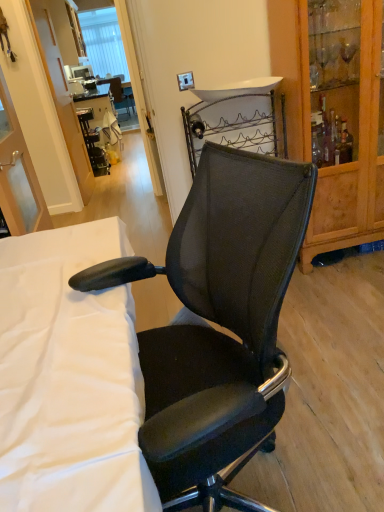
What do you see at coordinates (343, 121) in the screenshot?
I see `wooden cabinet at right` at bounding box center [343, 121].

At what (x,y) coordinates should I click in order to perform the action: click on wooden cabinet at right. Please return your answer as a coordinate pair (x, y). The image size is (384, 512). Looking at the image, I should click on (343, 121).

What do you see at coordinates (218, 320) in the screenshot?
I see `black mesh office chair at center` at bounding box center [218, 320].

Where is `black plastic table at center`? The image size is (384, 512). black plastic table at center is located at coordinates (95, 126).

Is wooden cabinet at right surrounding black mesh office chair at center?

No.

Considering the relative positions of wooden cabinet at right and black mesh office chair at center in the image provided, is wooden cabinet at right to the right of black mesh office chair at center from the viewer's perspective?

Indeed, wooden cabinet at right is positioned on the right side of black mesh office chair at center.

Can you tell me how much wooden cabinet at right and black mesh office chair at center differ in facing direction?

wooden cabinet at right and black mesh office chair at center are facing 73.5 degrees away from each other.

From a real-world perspective, is black plastic table at center above or below black mesh office chair at center?

In terms of real-world spatial position, black plastic table at center is below black mesh office chair at center.

From the image's perspective, does black plastic table at center appear higher than black mesh office chair at center?

Yes, from the image's perspective, black plastic table at center is on top of black mesh office chair at center.

From the picture: Can you confirm if black plastic table at center is positioned to the right of black mesh office chair at center?

No, black plastic table at center is not to the right of black mesh office chair at center.

Is white fabric at center to the right of wooden cabinet at right from the viewer's perspective?

Incorrect, white fabric at center is not on the right side of wooden cabinet at right.

Based on the photo, considering the relative sizes of white fabric at center and wooden cabinet at right in the image provided, is white fabric at center bigger than wooden cabinet at right?

Correct, white fabric at center is larger in size than wooden cabinet at right.

How many degrees apart are the facing directions of white fabric at center and wooden cabinet at right?

90 degrees separate the facing orientations of white fabric at center and wooden cabinet at right.

Where is `desk in front of the wooden cabinet at right`? Image resolution: width=384 pixels, height=512 pixels. desk in front of the wooden cabinet at right is located at coordinates (69, 377).

You are a GUI agent. You are given a task and a screenshot of the screen. Output one action in this format:
    pyautogui.click(x=<x>, y=<y>)
    Task: Click on the desk that is in front of the black mesh office chair at center
    This screenshot has height=512, width=384.
    Given the screenshot: What is the action you would take?
    pyautogui.click(x=69, y=377)

Can you confirm if white fabric at center is smaller than black mesh office chair at center?

Incorrect, white fabric at center is not smaller in size than black mesh office chair at center.

Considering the relative positions of white fabric at center and black mesh office chair at center in the image provided, is white fabric at center to the right of black mesh office chair at center from the viewer's perspective?

No, white fabric at center is not to the right of black mesh office chair at center.

Which of these two, white fabric at center or black mesh office chair at center, stands shorter?

white fabric at center.

From the image's perspective, which is below, black plastic table at center or white fabric at center?

From the image's view, white fabric at center is below.

Is black plastic table at center far from white fabric at center?

Yes.

Consider the image. Is black plastic table at center located outside white fabric at center?

Yes, black plastic table at center is outside of white fabric at center.

Is the position of black plastic table at center less distant than that of white fabric at center?

No, the depth of black plastic table at center is greater than that of white fabric at center.

Considering the sizes of objects black mesh office chair at center and wooden cabinet at right in the image provided, who is shorter, black mesh office chair at center or wooden cabinet at right?

Standing shorter between the two is black mesh office chair at center.

Based on the photo, is black mesh office chair at center touching wooden cabinet at right?

black mesh office chair at center and wooden cabinet at right are clearly separated.

Does black mesh office chair at center turn towards wooden cabinet at right?

No, black mesh office chair at center is not aimed at wooden cabinet at right.

Which of these two, black mesh office chair at center or wooden cabinet at right, is wider?

Wider between the two is black mesh office chair at center.

From a real-world perspective, is wooden cabinet at right positioned under white fabric at center based on gravity?

Incorrect, from a real-world perspective, wooden cabinet at right is higher than white fabric at center.

In the scene shown: Considering the sizes of objects wooden cabinet at right and white fabric at center in the image provided, who is shorter, wooden cabinet at right or white fabric at center?

white fabric at center.

Considering the positions of objects wooden cabinet at right and white fabric at center in the image provided, who is in front, wooden cabinet at right or white fabric at center?

white fabric at center is more forward.

From the picture: From the image's perspective, is wooden cabinet at right located above or below white fabric at center?

Clearly, from the image's perspective, wooden cabinet at right is above white fabric at center.

Image resolution: width=384 pixels, height=512 pixels. I want to click on cabinetry on the right of black mesh office chair at center, so click(x=343, y=121).

At what (x,y) coordinates should I click in order to perform the action: click on chair located above the black plastic table at center (from a real-world perspective). Please return your answer as a coordinate pair (x, y). Looking at the image, I should click on (218, 320).

Estimate the real-world distances between objects in this image. Which object is further from black plastic table at center, black mesh office chair at center or white fabric at center?

black mesh office chair at center is positioned further to the anchor black plastic table at center.

When comparing their distances from white fabric at center, does black plastic table at center or wooden cabinet at right seem further?

Based on the image, black plastic table at center appears to be further to white fabric at center.

From the image, which object appears to be nearer to wooden cabinet at right, white fabric at center or black plastic table at center?

white fabric at center is closer to wooden cabinet at right.

Considering their positions, is black mesh office chair at center positioned further to white fabric at center than black plastic table at center?

Among the two, black plastic table at center is located further to white fabric at center.

Looking at this image, when comparing their distances from wooden cabinet at right, does black mesh office chair at center or black plastic table at center seem further?

black plastic table at center is positioned further to the anchor wooden cabinet at right.

Considering their positions, is wooden cabinet at right positioned closer to black plastic table at center than black mesh office chair at center?

wooden cabinet at right.

Looking at the image, which one is located further to wooden cabinet at right, black plastic table at center or white fabric at center?

Among the two, black plastic table at center is located further to wooden cabinet at right.

Considering their positions, is black plastic table at center positioned closer to white fabric at center than black mesh office chair at center?

black mesh office chair at center lies closer to white fabric at center than the other object.

Identify the location of chair between white fabric at center and wooden cabinet at right along the z-axis. Image resolution: width=384 pixels, height=512 pixels. (218, 320).

Locate an element on the screen. The image size is (384, 512). chair between white fabric at center and black plastic table at center in the front-back direction is located at coordinates (218, 320).

Identify the location of cabinetry between white fabric at center and black plastic table at center from front to back. This screenshot has width=384, height=512. (343, 121).

This screenshot has height=512, width=384. I want to click on cabinetry between black mesh office chair at center and black plastic table at center in the front-back direction, so click(x=343, y=121).